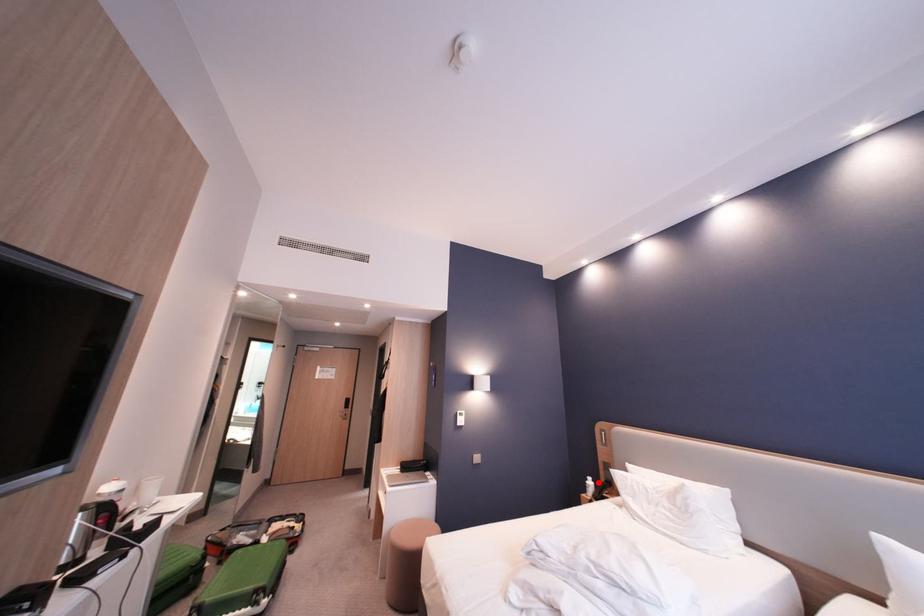
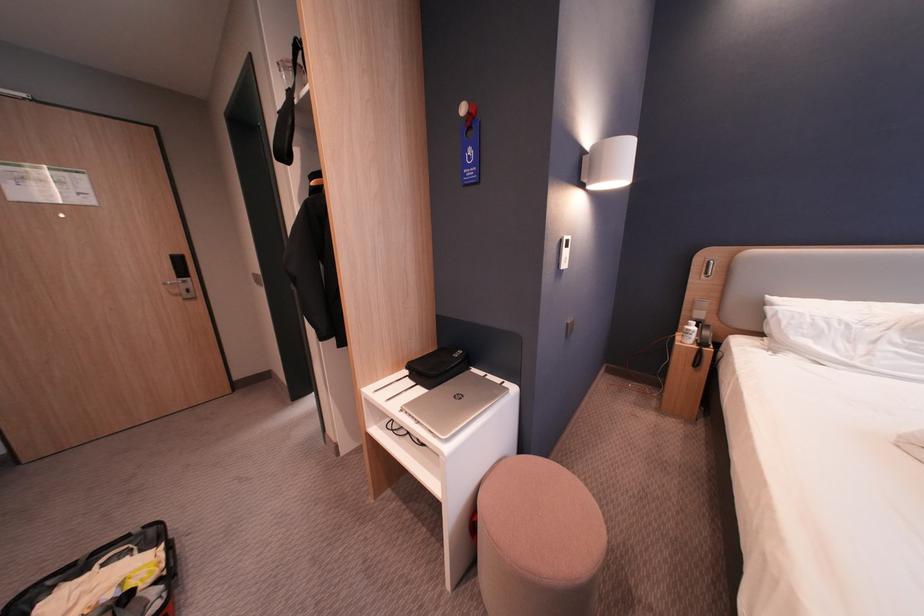
The point at the highlighted location is marked in the first image. Where is the corresponding point in the second image?

(698, 328)